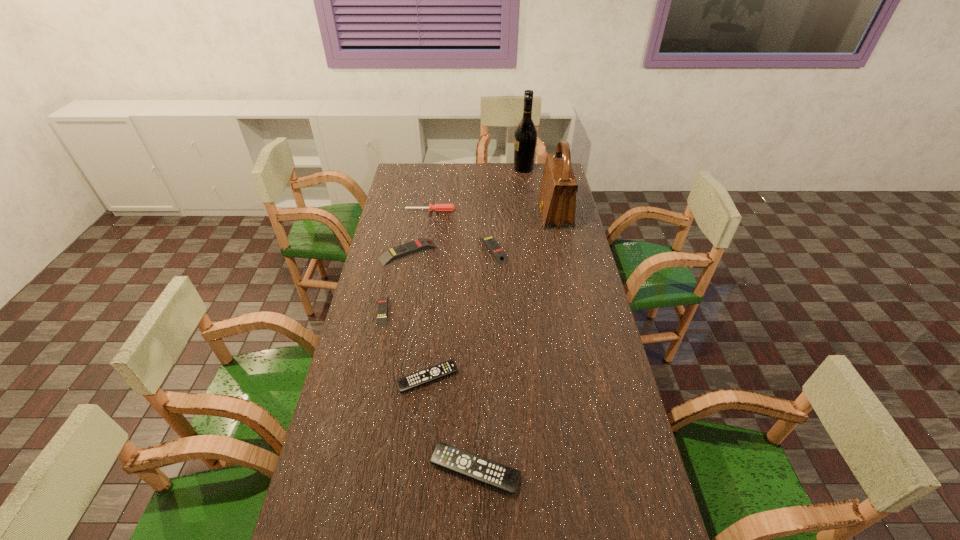
Find the location of `vacant space at the left edge of the desktop`. vacant space at the left edge of the desktop is located at coordinates (381, 418).

I want to click on vacant area at the right edge, so click(581, 262).

You are a GUI agent. You are given a task and a screenshot of the screen. Output one action in this format:
    pyautogui.click(x=<x>, y=<y>)
    Task: Click on the free space between the fourth farthest remote control and the black wine bottle
    The image size is (960, 540).
    Given the screenshot: What is the action you would take?
    pyautogui.click(x=475, y=273)

At what (x,y) coordinates should I click in order to perform the action: click on free spot between the rightmost yellow remote control and the farther black remote control. Please return your answer as a coordinate pair (x, y). Looking at the image, I should click on (461, 314).

You are a GUI agent. You are given a task and a screenshot of the screen. Output one action in this format:
    pyautogui.click(x=<x>, y=<y>)
    Task: Click on the vacant area between the shoulder bag and the sixth farthest object
    The height and width of the screenshot is (540, 960).
    Given the screenshot: What is the action you would take?
    pyautogui.click(x=468, y=262)

Locate an element on the screen. This screenshot has width=960, height=540. unoccupied area between the bigger black remote control and the red screwdriver is located at coordinates (453, 340).

Identify the location of vacant area that lies between the bigger black remote control and the screwdriver. This screenshot has height=540, width=960. (453, 340).

The image size is (960, 540). Find the location of `empty location between the screwdriver and the rightmost yellow remote control`. empty location between the screwdriver and the rightmost yellow remote control is located at coordinates (462, 230).

The image size is (960, 540). I want to click on unoccupied area between the nearest remote control and the shoulder bag, so click(515, 342).

You are a GUI agent. You are given a task and a screenshot of the screen. Output one action in this format:
    pyautogui.click(x=<x>, y=<y>)
    Task: Click on the free area in between the second biggest yellow remote control and the screwdriver
    
    Given the screenshot: What is the action you would take?
    pyautogui.click(x=462, y=230)